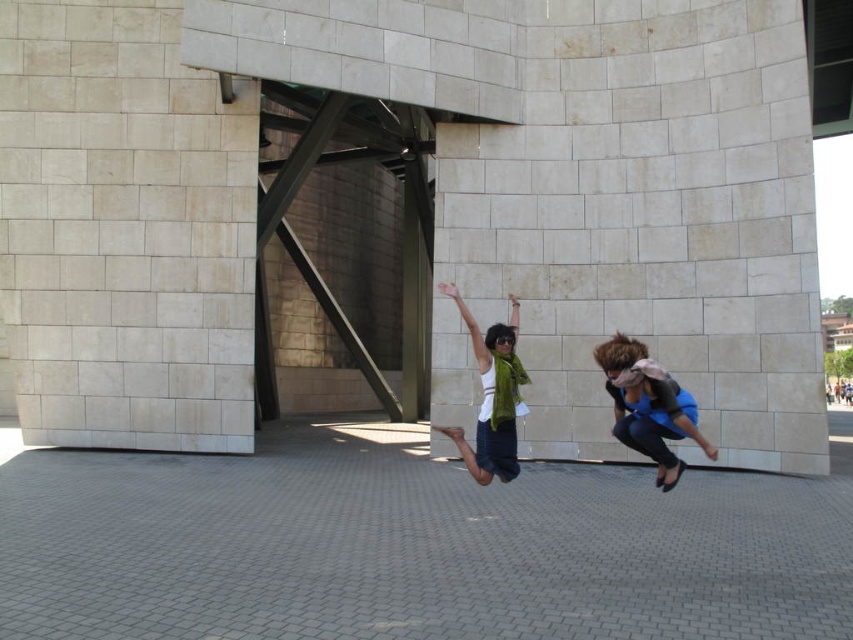
Is point (238, 282) closer to camera compared to point (642, 416)?

No, it is not.

Which is behind, point (131, 72) or point (634, 435)?

Positioned behind is point (131, 72).

Measure the distance between beige stone pillar at lower left and camera.

beige stone pillar at lower left and camera are 31.74 meters apart from each other.

Locate an element on the screen. This screenshot has height=640, width=853. beige stone pillar at lower left is located at coordinates (123, 230).

You are a GUI agent. You are given a task and a screenshot of the screen. Output one action in this format:
    pyautogui.click(x=<x>, y=<y>)
    Task: Click on the beige stone pillar at lower left
    Image resolution: width=853 pixels, height=640 pixels.
    Given the screenshot: What is the action you would take?
    pyautogui.click(x=123, y=230)

Can you confirm if beige stone pillar at lower left is positioned to the right of green scarf at center?

In fact, beige stone pillar at lower left is to the left of green scarf at center.

Is point (4, 157) behind point (485, 474)?

That is True.

The height and width of the screenshot is (640, 853). What are the coordinates of `beige stone pillar at lower left` in the screenshot? It's located at (123, 230).

Who is positioned more to the right, blue fabric at center or green scarf at center?

From the viewer's perspective, blue fabric at center appears more on the right side.

Is point (659, 394) positioned behind point (482, 339)?

No, it is in front of (482, 339).

This screenshot has width=853, height=640. What do you see at coordinates (648, 408) in the screenshot?
I see `blue fabric at center` at bounding box center [648, 408].

Identify the location of blue fabric at center. (648, 408).